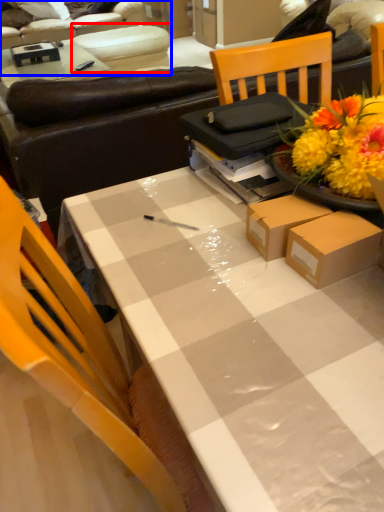
Question: Which object is closer to the camera taking this photo, armchair (highlighted by a red box) or studio couch (highlighted by a blue box)?

Choices:
 (A) armchair
 (B) studio couch

Answer: (A)